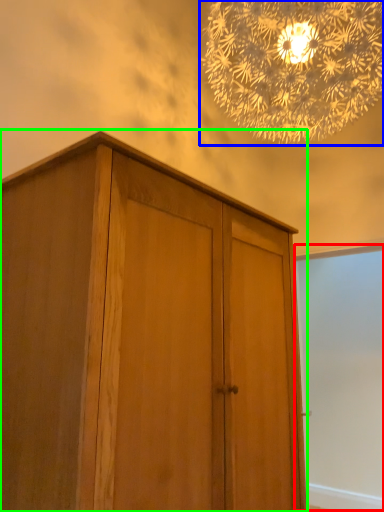
Question: Estimate the real-world distances between objects in this image. Which object is farther from screen door (highlighted by a red box), lamp (highlighted by a blue box) or cupboard (highlighted by a green box)?

Choices:
 (A) lamp
 (B) cupboard

Answer: (B)